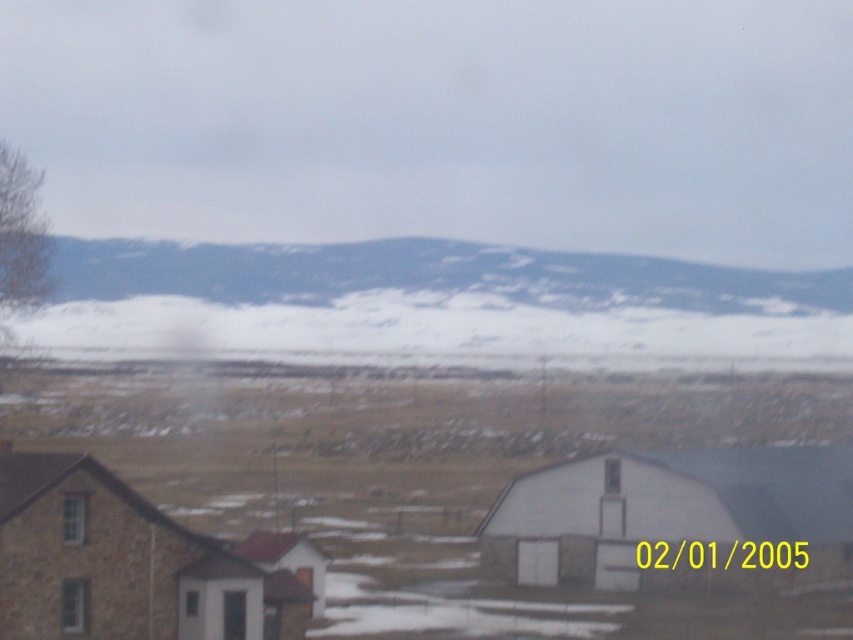
Between white matte barn at center and brown stone barn at lower left, which one has less height?

Standing shorter between the two is white matte barn at center.

Consider the image. Is white matte barn at center taller than brown stone barn at lower left?

No.

Does point (749, 572) lie behind point (283, 589)?

Yes, point (749, 572) is farther from viewer.

Locate an element on the screen. This screenshot has height=640, width=853. white matte barn at center is located at coordinates (674, 518).

Is white matte barn at center below snowy mountain at upper center?

Indeed, white matte barn at center is positioned under snowy mountain at upper center.

Can you confirm if white matte barn at center is taller than snowy mountain at upper center?

Incorrect, white matte barn at center's height is not larger of snowy mountain at upper center's.

Between point (666, 531) and point (140, 284), which one is positioned in front?

Positioned in front is point (666, 531).

Find the location of `white matte barn at center`. white matte barn at center is located at coordinates (674, 518).

Is point (111, 477) less distant than point (686, 289)?

Yes, it is in front of point (686, 289).

Between brown stone barn at lower left and snowy mountain at upper center, which one has more height?

snowy mountain at upper center

Which is behind, point (120, 481) or point (352, 266)?

Point (352, 266)

You are a GUI agent. You are given a task and a screenshot of the screen. Output one action in this format:
    pyautogui.click(x=<x>, y=<y>)
    Task: Click on the brown stone barn at lower left
    
    Given the screenshot: What is the action you would take?
    pyautogui.click(x=123, y=564)